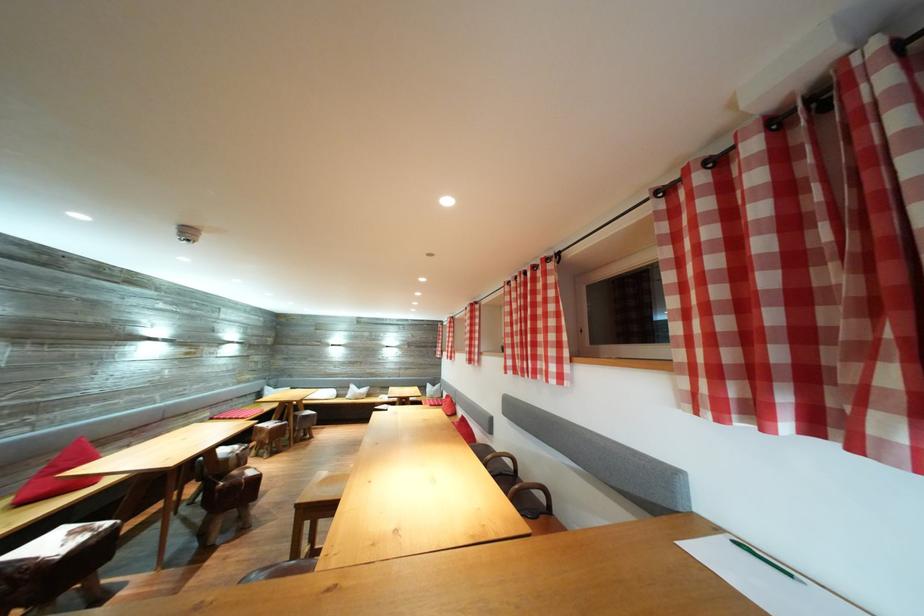
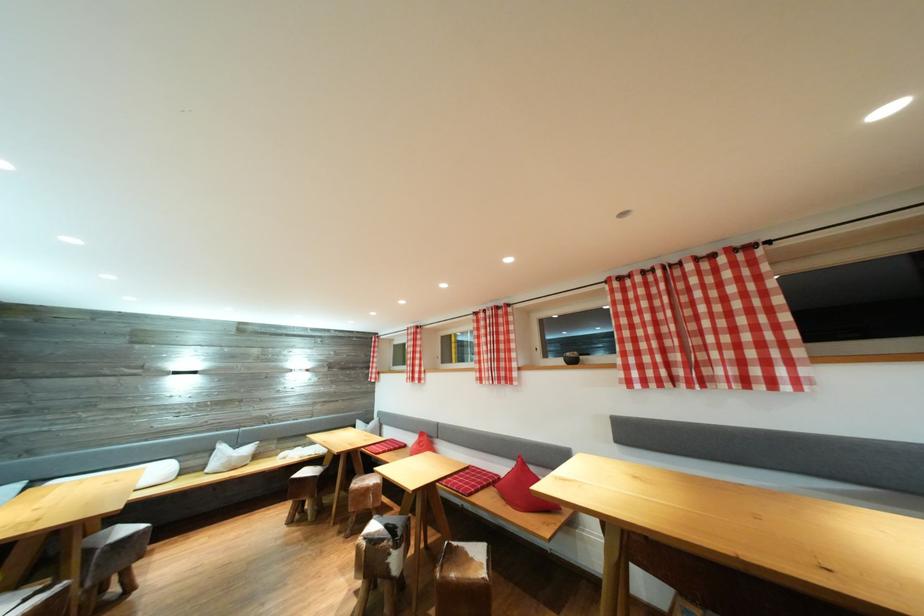
Where in the second image is the point corresponding to point 477,359 from the first image?

(505, 374)